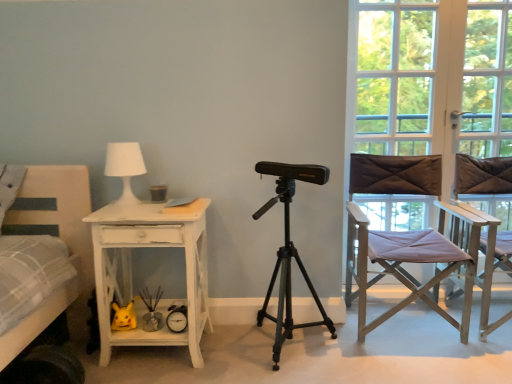
This screenshot has height=384, width=512. Identify the location of vacant space in between white distressed wood desk at left and metallic tripod at center. (233, 354).